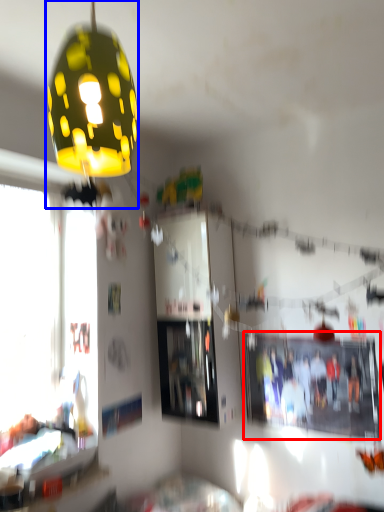
Question: Among these objects, which one is nearest to the camera, bulletin board (highlighted by a red box) or lamp (highlighted by a blue box)?

Choices:
 (A) bulletin board
 (B) lamp

Answer: (B)